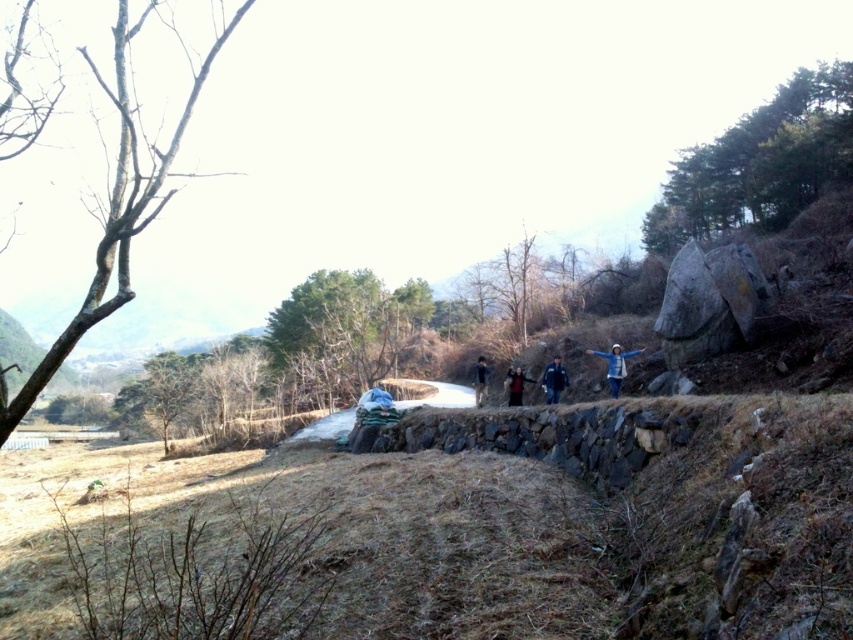
You are standing in the outdoor scene and want to place a small flag at the point closer to you between the two points labeled point (556, 394) and point (519, 368). Which point should you choose?

You should choose point (556, 394) because it is closer to the camera than point (519, 368).

You are a photographer trying to capture a photo of the group of people in the center of the image. You notice two jackets, the dark red fabric jacket at center and the dark blue jacket at center. Which jacket is covering part of the other?

The dark red fabric jacket at center is positioned over the dark blue jacket at center, so the dark red fabric jacket at center is covering part of the dark blue jacket at center.